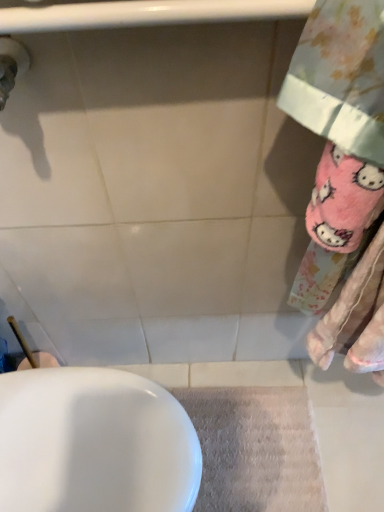
Question: From a real-world perspective, is white glossy sink at lower left physically below beige textured bath mat at lower center?

Choices:
 (A) no
 (B) yes

Answer: (A)

Question: Considering the relative sizes of white glossy sink at lower left and beige textured bath mat at lower center in the image provided, is white glossy sink at lower left bigger than beige textured bath mat at lower center?

Choices:
 (A) no
 (B) yes

Answer: (B)

Question: Is beige textured bath mat at lower center surrounded by white glossy sink at lower left?

Choices:
 (A) no
 (B) yes

Answer: (A)

Question: Is white glossy sink at lower left not close to beige textured bath mat at lower center?

Choices:
 (A) yes
 (B) no

Answer: (B)

Question: Is white glossy sink at lower left wider than beige textured bath mat at lower center?

Choices:
 (A) yes
 (B) no

Answer: (A)

Question: Can you confirm if white glossy sink at lower left is shorter than beige textured bath mat at lower center?

Choices:
 (A) no
 (B) yes

Answer: (A)

Question: Is beige textured bath mat at lower center facing away from white glossy sink at lower left?

Choices:
 (A) no
 (B) yes

Answer: (B)

Question: Is beige textured bath mat at lower center placed right next to white glossy sink at lower left?

Choices:
 (A) yes
 (B) no

Answer: (B)

Question: Considering the relative sizes of beige textured bath mat at lower center and white glossy sink at lower left in the image provided, is beige textured bath mat at lower center taller than white glossy sink at lower left?

Choices:
 (A) no
 (B) yes

Answer: (A)

Question: Does beige textured bath mat at lower center contain white glossy sink at lower left?

Choices:
 (A) yes
 (B) no

Answer: (B)

Question: From the image's perspective, is beige textured bath mat at lower center located beneath white glossy sink at lower left?

Choices:
 (A) no
 (B) yes

Answer: (B)

Question: Does beige textured bath mat at lower center turn towards white glossy sink at lower left?

Choices:
 (A) no
 (B) yes

Answer: (A)

Question: From a real-world perspective, is white glossy sink at lower left physically located above or below beige textured bath mat at lower center?

Choices:
 (A) below
 (B) above

Answer: (B)